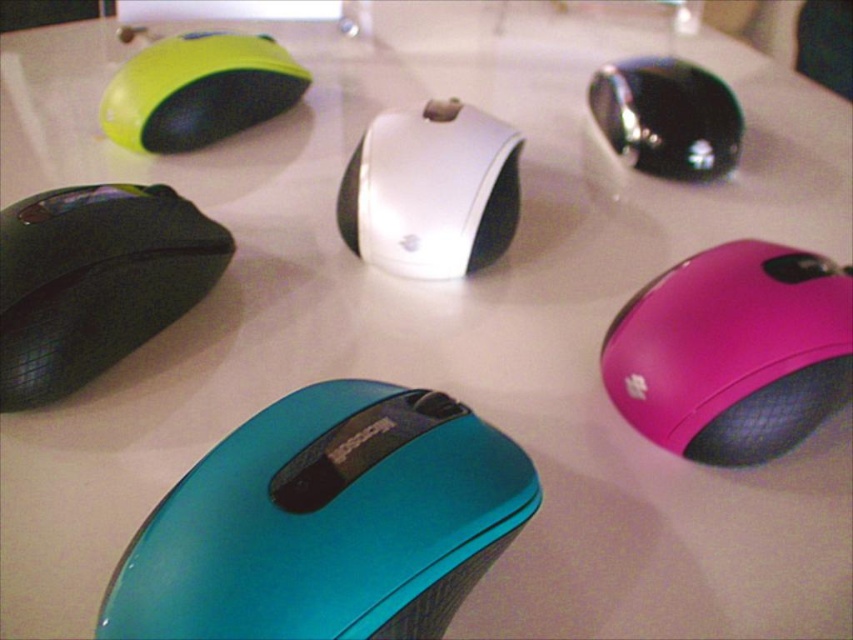
At what (x,y) coordinates should I click in order to perform the action: click on pink glossy mouse at lower right. Please return your answer as a coordinate pair (x, y). Looking at the image, I should click on (733, 353).

Can you confirm if pink glossy mouse at lower right is positioned below white glossy mouse at center?

Correct, pink glossy mouse at lower right is located below white glossy mouse at center.

Who is more forward, (x=839, y=364) or (x=485, y=241)?

Positioned in front is point (x=839, y=364).

In order to click on pink glossy mouse at lower right in this screenshot , I will do `click(733, 353)`.

Which is in front, point (393, 452) or point (236, 70)?

Point (393, 452)

Is point (254, 620) in front of point (267, 97)?

Yes.

You are a GUI agent. You are given a task and a screenshot of the screen. Output one action in this format:
    pyautogui.click(x=<x>, y=<y>)
    Task: Click on the teal glossy mouse at lower center
    The height and width of the screenshot is (640, 853).
    Given the screenshot: What is the action you would take?
    pyautogui.click(x=328, y=522)

Where is `teal glossy mouse at lower center`? This screenshot has height=640, width=853. teal glossy mouse at lower center is located at coordinates (328, 522).

Measure the distance between matte black mouse at left and white glossy mouse at center.

matte black mouse at left and white glossy mouse at center are 16.41 inches apart.

Is matte black mouse at left to the left of white glossy mouse at center from the viewer's perspective?

Correct, you'll find matte black mouse at left to the left of white glossy mouse at center.

Measure the distance between point (143, 291) and camera.

Point (143, 291) is 1.27 meters from camera.

This screenshot has width=853, height=640. I want to click on matte black mouse at left, so click(x=96, y=282).